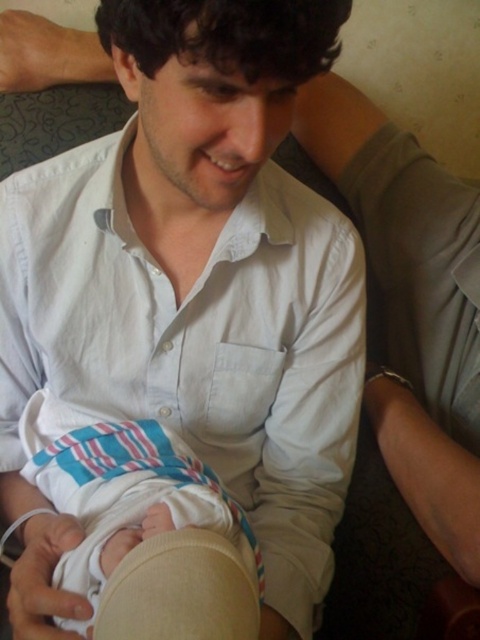
Does white cotton shirt at center have a greater height compared to striped cotton diaper at center?

Yes.

Which is behind, point (109, 324) or point (82, 470)?

Point (109, 324)

Which is behind, point (301, 289) or point (204, 470)?

The point (301, 289) is more distant.

Identify the location of white cotton shirt at center. (199, 342).